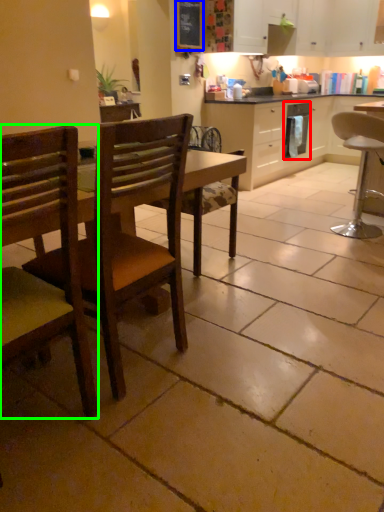
Question: Considering the real-world distances, which object is closest to dish washer (highlighted by a red box)? bulletin board (highlighted by a blue box) or chair (highlighted by a green box).

Choices:
 (A) bulletin board
 (B) chair

Answer: (A)